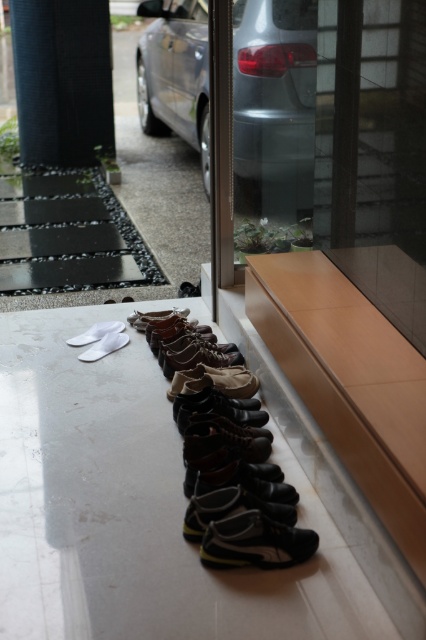
Can you confirm if black leather shoes at center is shorter than white fabric slipper at lower left?

In fact, black leather shoes at center may be taller than white fabric slipper at lower left.

Who is taller, black leather shoes at center or white fabric slipper at lower left?

Standing taller between the two is black leather shoes at center.

Is point (215, 515) positioned behind point (71, 342)?

That is False.

Identify the location of black leather shoes at center. Image resolution: width=426 pixels, height=640 pixels. (235, 483).

Does black leather shoes at center have a greater width compared to black fabric pillar at upper left?

In fact, black leather shoes at center might be narrower than black fabric pillar at upper left.

Based on the photo, does black leather shoes at center come in front of black fabric pillar at upper left?

Yes, black leather shoes at center is closer to the viewer.

Describe the element at coordinates (235, 483) in the screenshot. This screenshot has height=640, width=426. I see `black leather shoes at center` at that location.

You are a GUI agent. You are given a task and a screenshot of the screen. Output one action in this format:
    pyautogui.click(x=<x>, y=<y>)
    Task: Click on the black leather shoes at center
    The width and height of the screenshot is (426, 640).
    Given the screenshot: What is the action you would take?
    pyautogui.click(x=235, y=483)

From the picture: Who is shorter, black suede shoe at center or white fabric slipper at lower left?

With less height is white fabric slipper at lower left.

Looking at this image, which of these two, black suede shoe at center or white fabric slipper at lower left, stands taller?

black suede shoe at center is taller.

Does point (213, 552) come closer to viewer compared to point (101, 326)?

Yes, point (213, 552) is closer to viewer.

This screenshot has width=426, height=640. Find the location of `black suede shoe at center`. black suede shoe at center is located at coordinates (255, 541).